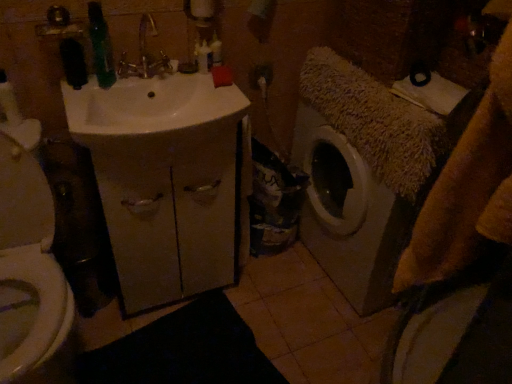
Question: Considering the positions of white plastic bottle at upper center, the 2th toiletry when ordered from right to left, and white glossy toilet at left in the image, is white plastic bottle at upper center, the 2th toiletry when ordered from right to left, bigger or smaller than white glossy toilet at left?

Choices:
 (A) big
 (B) small

Answer: (B)

Question: From the image's perspective, is white plastic bottle at upper center, which is counted as the first toiletry, starting from the left, located above or below white glossy toilet at left?

Choices:
 (A) above
 (B) below

Answer: (A)

Question: Which of these objects is positioned closest to the white glossy toilet at left?

Choices:
 (A) translucent plastic bottle at upper center, which is the 1th toiletry in right-to-left order
 (B) white plastic bottle at upper center, the 2th toiletry when ordered from right to left
 (C) white matte cabinet at center
 (D) gold metallic faucet at upper center

Answer: (C)

Question: Estimate the real-world distances between objects in this image. Which object is closer to the white matte cabinet at center?

Choices:
 (A) translucent plastic bottle at upper center, which is the 1th toiletry in right-to-left order
 (B) white plastic bottle at upper center, which is counted as the first toiletry, starting from the left
 (C) gold metallic faucet at upper center
 (D) white glossy toilet at left

Answer: (D)